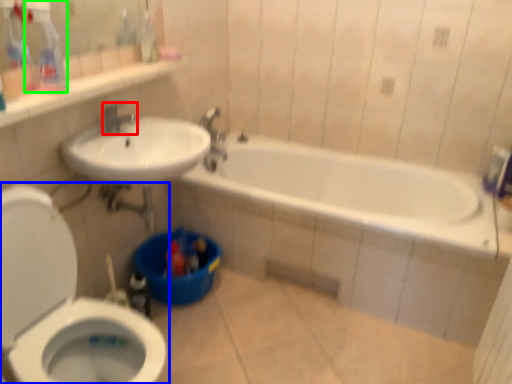
Question: Which is farther away from tap (highlighted by a red box)? toilet (highlighted by a blue box) or cleaning product (highlighted by a green box)?

Choices:
 (A) toilet
 (B) cleaning product

Answer: (A)